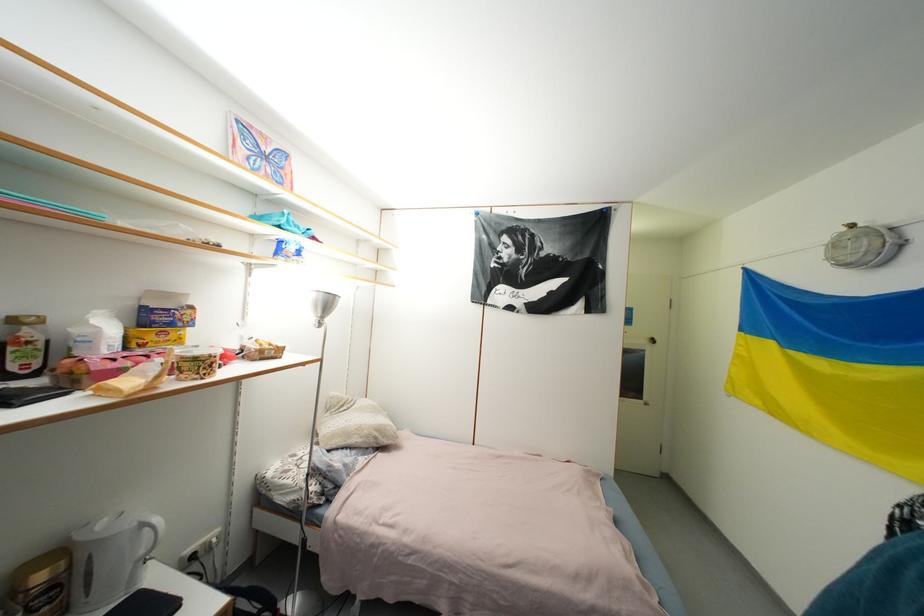
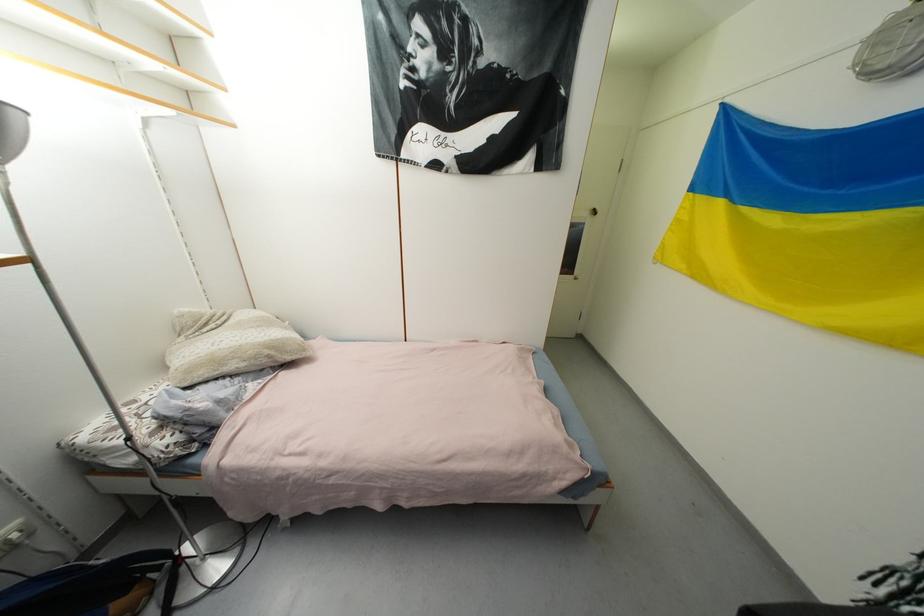
Find the pixel in the second image that matches [372,438] in the first image.

(261, 359)